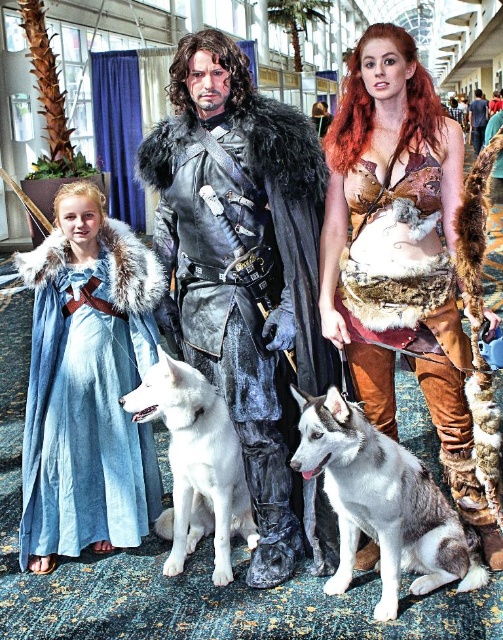
Does point (201, 136) come closer to viewer compared to point (356, 460)?

No, it is behind (356, 460).

Which of these two, leather fur-trimmed armor at center or gray-white fur dog at center, stands taller?

leather fur-trimmed armor at center

The height and width of the screenshot is (640, 503). Describe the element at coordinates (242, 280) in the screenshot. I see `leather fur-trimmed armor at center` at that location.

This screenshot has width=503, height=640. Find the location of `leather fur-trimmed armor at center`. leather fur-trimmed armor at center is located at coordinates (242, 280).

Who is shorter, leather fur-trimmed armor at center or white fur dog at center?

Standing shorter between the two is white fur dog at center.

Image resolution: width=503 pixels, height=640 pixels. What are the coordinates of `leather fur-trimmed armor at center` in the screenshot? It's located at (242, 280).

Which is in front, point (257, 394) or point (225, 572)?

Point (257, 394) is more forward.

The height and width of the screenshot is (640, 503). What are the coordinates of `leather fur-trimmed armor at center` in the screenshot? It's located at (242, 280).

Between shiny fur vest at center and blue cotton dress at left, which one is positioned lower?

blue cotton dress at left

Does point (396, 241) lie behind point (73, 512)?

No, it is in front of (73, 512).

Between point (415, 285) and point (117, 353), which one is positioned behind?

Point (117, 353)

Where is `shiny fur vest at center`? The image size is (503, 640). shiny fur vest at center is located at coordinates (399, 252).